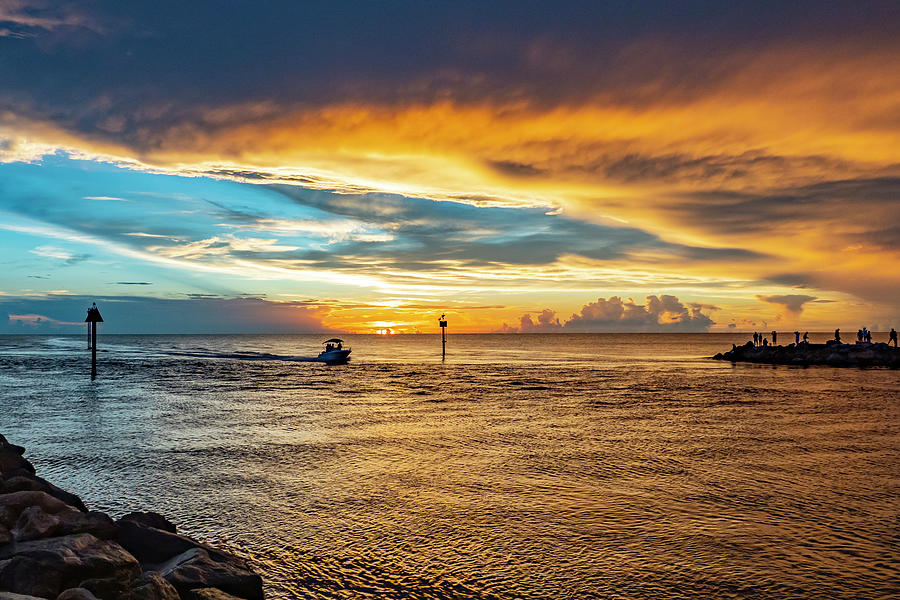
Image resolution: width=900 pixels, height=600 pixels. In order to click on markers in this screenshot , I will do `click(99, 315)`, `click(91, 346)`, `click(441, 333)`.